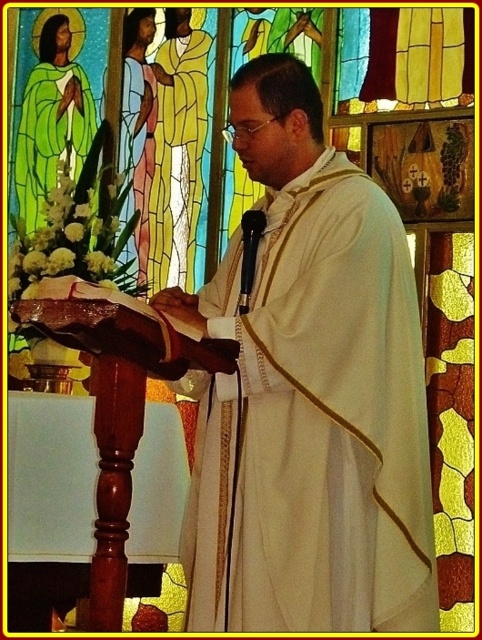
You are an interior designer planning to add a new element to the church scene. You notice the yellow textured robe at center and the matte gold robe at center. Which robe is positioned higher in the image?

The yellow textured robe at center is positioned higher than the matte gold robe at center.

You are standing in the church and want to approach the white matte robe at center. Based on its 2D coordinates, in which direction should you move from your current position at point 0.5, 0.5?

The white matte robe at center is located at point (308, 394), which is northeast of your current position at (241, 320). You should move northeast to reach it.